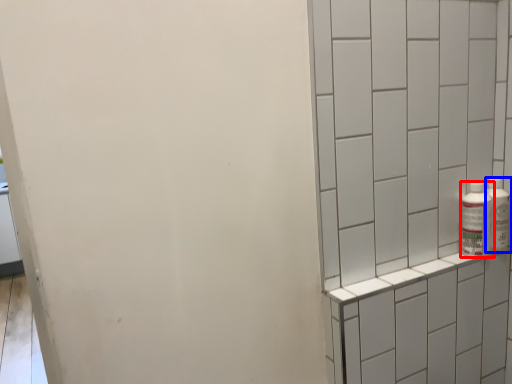
Question: Which of the following is the farthest to the observer, bottle (highlighted by a red box) or bottle (highlighted by a blue box)?

Choices:
 (A) bottle
 (B) bottle

Answer: (B)